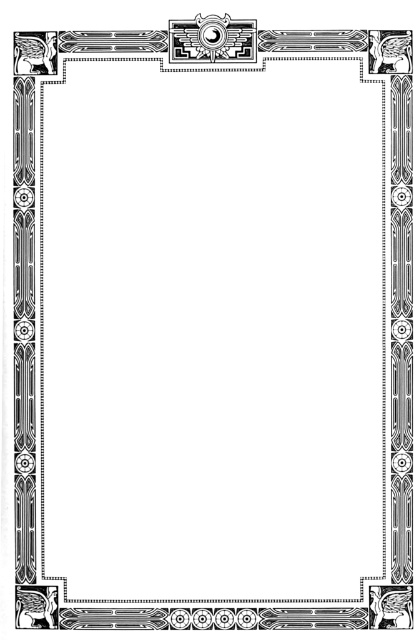
Question: Is the position of matte black square at bottom right less distant than that of matte black circle at upper center?

Choices:
 (A) yes
 (B) no

Answer: (A)

Question: Is matte black square at bottom right to the left of matte black circle at upper center from the viewer's perspective?

Choices:
 (A) yes
 (B) no

Answer: (B)

Question: Which object is farther from the camera taking this photo?

Choices:
 (A) matte black circle at upper center
 (B) matte black square at bottom right

Answer: (A)

Question: Which of the following is the farthest from the observer?

Choices:
 (A) matte black square at bottom right
 (B) matte black circle at upper center

Answer: (B)

Question: Is matte black square at bottom right wider than matte black circle at upper center?

Choices:
 (A) no
 (B) yes

Answer: (B)

Question: Among these points, which one is farthest from the camera?

Choices:
 (A) (212, 19)
 (B) (380, 593)

Answer: (B)